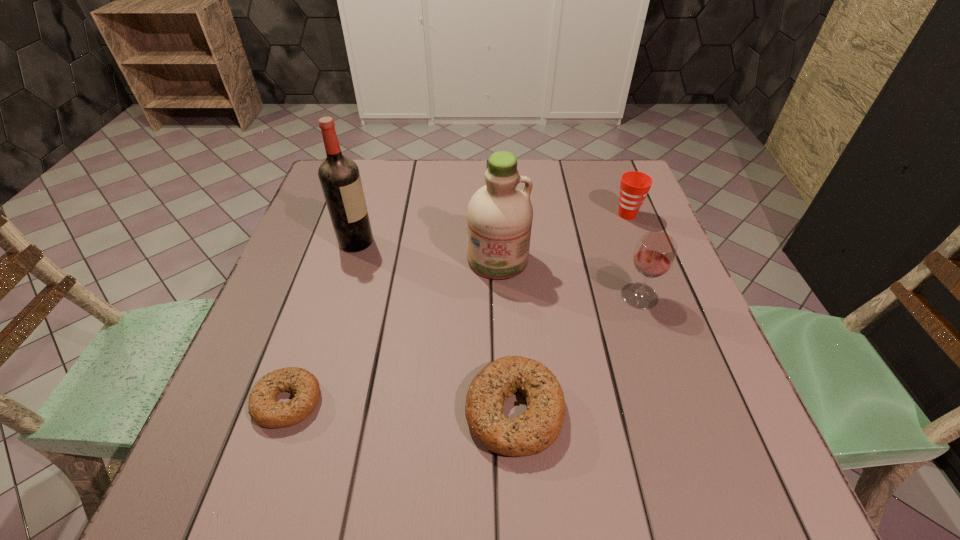
The image size is (960, 540). Identify the location of the shorter bagel. (264, 409).

Where is `the left bagel`? the left bagel is located at coordinates (264, 409).

I want to click on the right bagel, so click(x=535, y=430).

Identify the location of the fifth tallest object. (535, 430).

Find the location of a particular element. the second tallest object is located at coordinates (499, 215).

The height and width of the screenshot is (540, 960). What are the coordinates of `liquor` in the screenshot? It's located at (339, 176).

I want to click on the fourth tallest object, so click(634, 186).

Locate an element on the screen. This screenshot has width=960, height=540. cup is located at coordinates (634, 186).

At what (x,y) coordinates should I click in order to perform the action: click on the fourth shortest object. Please return your answer as a coordinate pair (x, y). Image resolution: width=960 pixels, height=540 pixels. Looking at the image, I should click on (654, 255).

Find the location of a particular element. The height and width of the screenshot is (540, 960). the third nearest object is located at coordinates (654, 255).